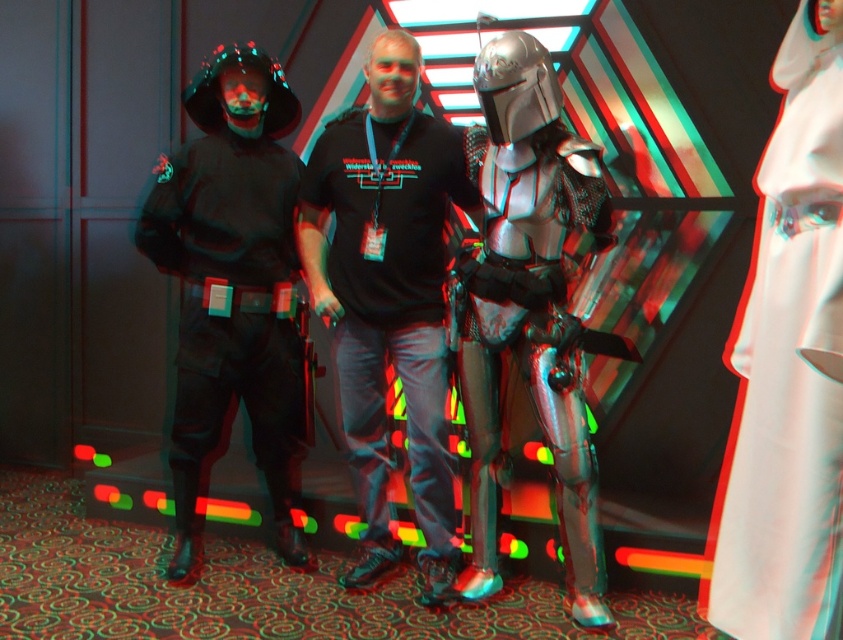
Between black matte costume at left and shiny silver armor at center, which one appears on the left side from the viewer's perspective?

From the viewer's perspective, black matte costume at left appears more on the left side.

Find the location of a particular element. The width and height of the screenshot is (843, 640). black matte costume at left is located at coordinates (232, 282).

Identify the location of black matte costume at left. (232, 282).

In the scene shown: Is white satin dress at center to the left of shiny silver armor at center from the viewer's perspective?

No, white satin dress at center is not to the left of shiny silver armor at center.

Does white satin dress at center appear over shiny silver armor at center?

Yes.

The width and height of the screenshot is (843, 640). In order to click on white satin dress at center in this screenshot , I will do `click(788, 365)`.

The width and height of the screenshot is (843, 640). I want to click on white satin dress at center, so click(x=788, y=365).

Which is in front, point (787, 582) or point (430, 384)?

Point (787, 582)

Can you confirm if white satin dress at center is smaller than black matte t-shirt at center?

Yes.

Between point (839, 490) and point (368, 429), which one is positioned behind?

Positioned behind is point (368, 429).

The height and width of the screenshot is (640, 843). What are the coordinates of `white satin dress at center` in the screenshot? It's located at (788, 365).